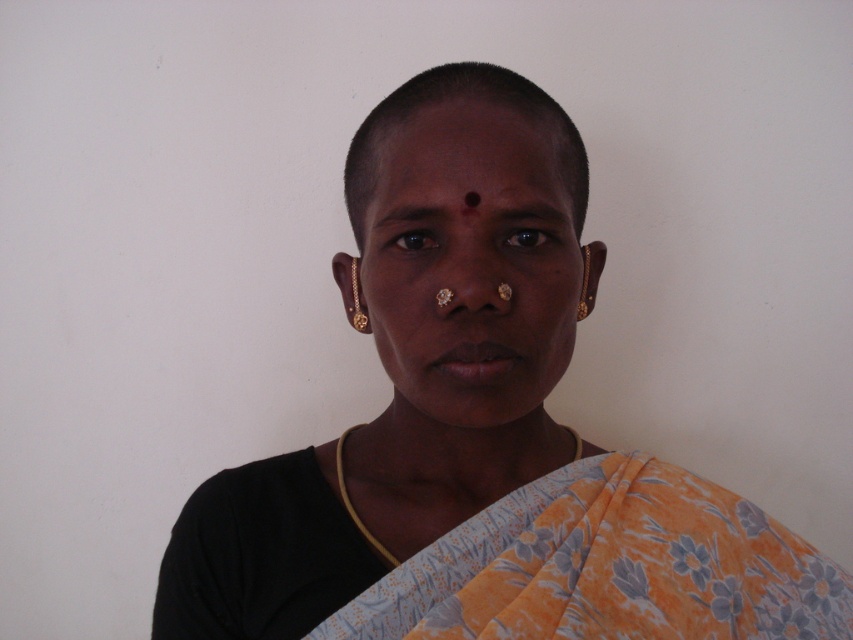
Consider the image. You are a photographer setting up a photo shoot with two markers placed at point (405, 184) and point (404, 232). You want to position the subject so they stand in front of both markers. Which marker should the subject be closer to?

The subject should be closer to point (405, 184) because it is in front of point (404, 232). This way, the subject can be positioned in front of both markers simultaneously.

You are a photographer adjusting the focus on your camera. You want to capture a clear image of both the matte gold nose ring at center and the brown smooth eyebrow at upper center. Which object should you focus on first to ensure it appears sharp in the photo?

You should focus on the matte gold nose ring at center first because it is closer to the viewer than the brown smooth eyebrow at upper center, so adjusting focus starting from the closer object ensures both can be in sharp focus.